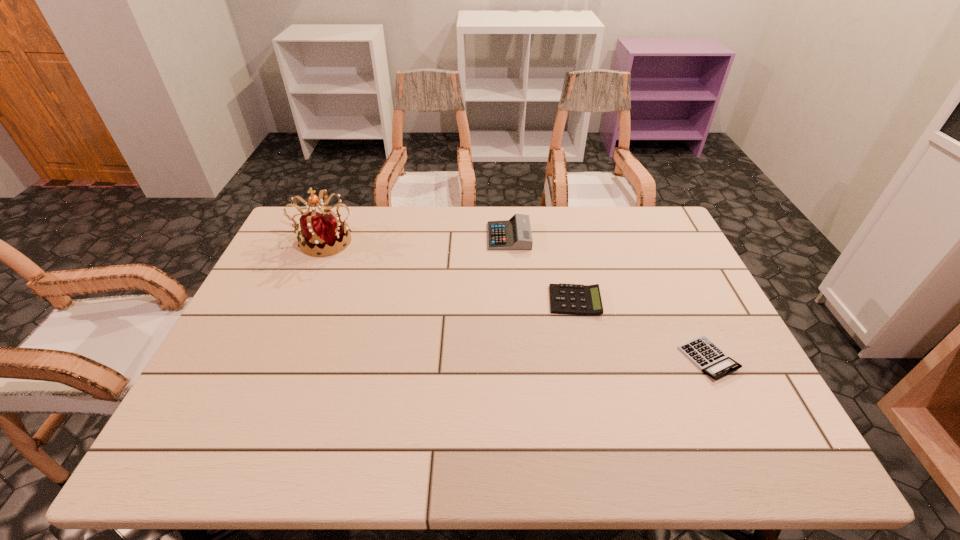
Locate an element on the screen. This screenshot has width=960, height=540. the leftmost object is located at coordinates (323, 231).

Where is `the tallest object`? the tallest object is located at coordinates 323,231.

The width and height of the screenshot is (960, 540). I want to click on the leftmost calculator, so [514, 234].

At what (x,y) coordinates should I click in order to perform the action: click on the third object from right to left. Please return your answer as a coordinate pair (x, y). The height and width of the screenshot is (540, 960). Looking at the image, I should click on (514, 234).

Where is `the second calculator from right to left`? Image resolution: width=960 pixels, height=540 pixels. the second calculator from right to left is located at coordinates (572, 299).

Where is `the second tallest calculator`? This screenshot has height=540, width=960. the second tallest calculator is located at coordinates (572, 299).

Locate an element on the screen. The image size is (960, 540). the nearest object is located at coordinates (710, 359).

Where is `the nearest calculator`? Image resolution: width=960 pixels, height=540 pixels. the nearest calculator is located at coordinates (710, 359).

The height and width of the screenshot is (540, 960). Find the location of `free region located 0.120m on the front-facing side of the leftmost object`. free region located 0.120m on the front-facing side of the leftmost object is located at coordinates (306, 286).

Where is `vacant position located 0.170m on the front of the second object from left to right`? This screenshot has width=960, height=540. vacant position located 0.170m on the front of the second object from left to right is located at coordinates (513, 287).